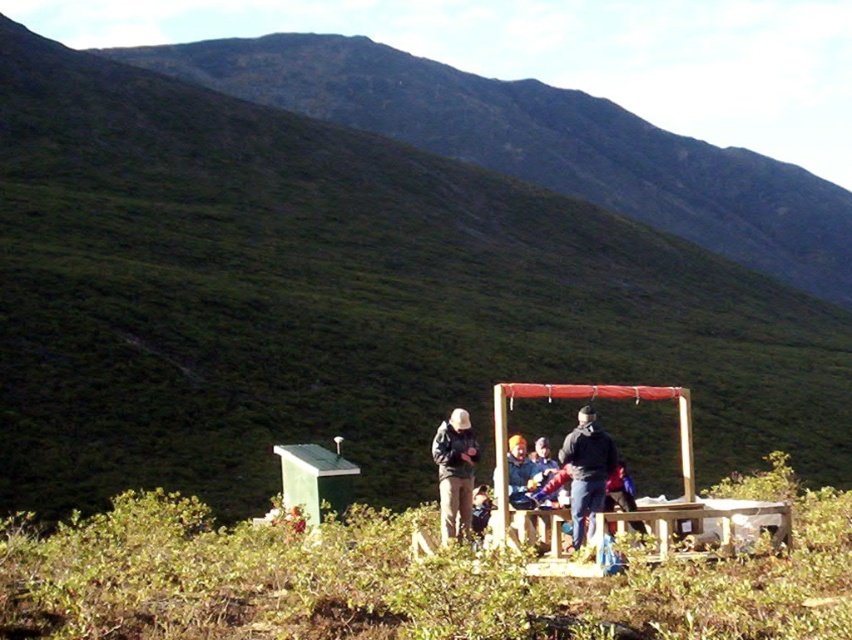
Which is more to the right, dark blue jacket at center or dark brown jacket at center?

dark blue jacket at center is more to the right.

Does point (583, 458) come farther from viewer compared to point (450, 524)?

Yes, it is.

This screenshot has width=852, height=640. What are the coordinates of `dark blue jacket at center` in the screenshot? It's located at (586, 470).

Between wooden picnic table at lower center and green matte hut at lower left, which one appears on the right side from the viewer's perspective?

Positioned to the right is wooden picnic table at lower center.

Is wooden picnic table at lower center further to the viewer compared to green matte hut at lower left?

No, wooden picnic table at lower center is closer to the viewer.

This screenshot has width=852, height=640. What do you see at coordinates (705, 522) in the screenshot?
I see `wooden picnic table at lower center` at bounding box center [705, 522].

In order to click on wooden picnic table at lower center in this screenshot , I will do `click(705, 522)`.

Looking at this image, who is more distant from viewer, (591,444) or (346,474)?

The point (346,474) is more distant.

Is point (600, 448) farther from camera compared to point (334, 470)?

No.

Identify the location of dark blue jacket at center. The height and width of the screenshot is (640, 852). (586, 470).